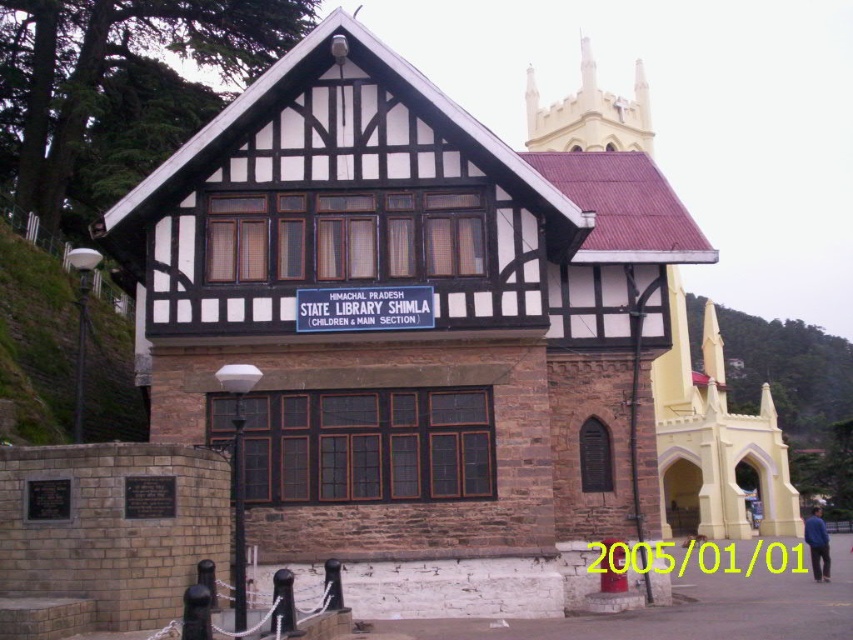
Describe the element at coordinates (407, 317) in the screenshot. I see `brown stone chapel at center` at that location.

Between point (283, 413) and point (549, 132), which one is positioned in front?

Point (283, 413) is in front.

You are a GUI agent. You are given a task and a screenshot of the screen. Output one action in this format:
    pyautogui.click(x=<x>, y=<y>)
    Task: Click on the brown stone chapel at center
    
    Given the screenshot: What is the action you would take?
    pyautogui.click(x=407, y=317)